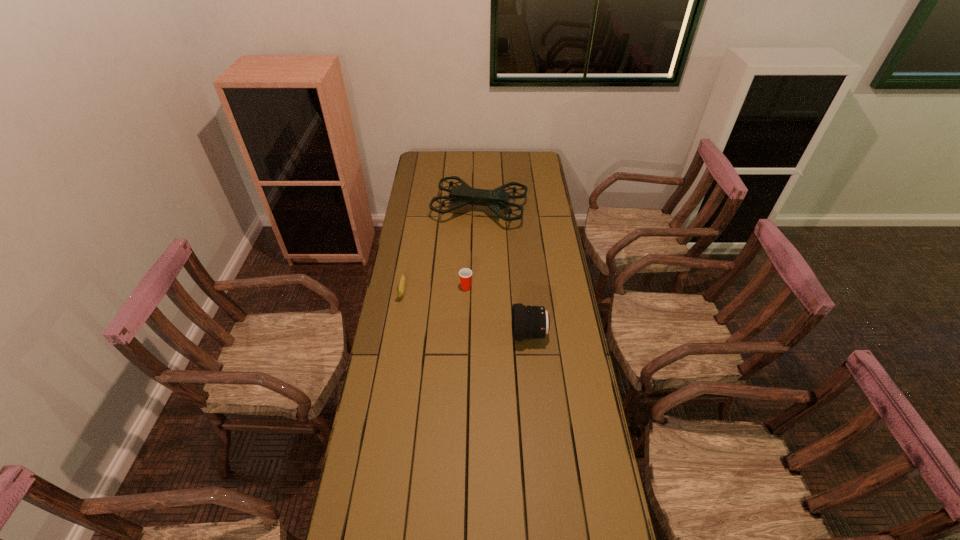
Find the location of a particular element. blank area located at the stem of the leftmost object is located at coordinates (396, 321).

Find the location of a particular element. vacant space situated 0.140m on the front of the Dixie cup is located at coordinates (465, 318).

You are a GUI agent. You are given a task and a screenshot of the screen. Output one action in this format:
    pyautogui.click(x=<x>, y=<y>)
    Task: Click on the drone present at the left edge
    
    Given the screenshot: What is the action you would take?
    pyautogui.click(x=461, y=195)

Locate an element on the screen. This screenshot has height=540, width=960. banana present at the left edge is located at coordinates (400, 291).

At what (x,y) coordinates should I click in order to perform the action: click on drone that is at the right edge. Please return your answer as a coordinate pair (x, y). The height and width of the screenshot is (540, 960). Looking at the image, I should click on tap(461, 195).

Identify the location of telephoto lens that is at the right edge. (528, 322).

This screenshot has height=540, width=960. In the image, there is a desktop. Find the location of `vacant space at the far edge`. vacant space at the far edge is located at coordinates (468, 167).

Find the location of a particular element. Image resolution: width=960 pixels, height=540 pixels. vacant region at the left edge is located at coordinates (429, 264).

Locate an element on the screen. The width and height of the screenshot is (960, 540). vacant region at the right edge is located at coordinates (555, 259).

Locate an element on the screen. free point between the banana and the third shortest object is located at coordinates (466, 312).